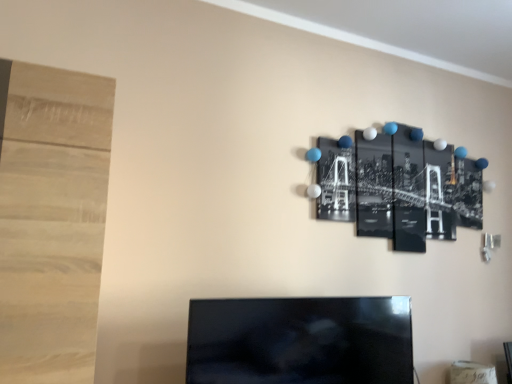
In order to face black glossy photo at upper right, should I rotate leftwards or rightwards?

To align with it, rotate right about 20.350°.

This screenshot has height=384, width=512. Describe the element at coordinates (413, 190) in the screenshot. I see `black glossy photo at upper right` at that location.

Locate an element on the screen. Image resolution: width=512 pixels, height=384 pixels. black glossy photo at upper right is located at coordinates (413, 190).

Locate an element on the screen. The width and height of the screenshot is (512, 384). black glossy tv at center is located at coordinates (300, 341).

What do you see at coordinates (300, 341) in the screenshot? The image size is (512, 384). I see `black glossy tv at center` at bounding box center [300, 341].

Measure the distance between point (217,340) and camera.

The depth of point (217,340) is 1.35 meters.

Locate an element on the screen. This screenshot has height=384, width=512. black glossy photo at upper right is located at coordinates (413, 190).

Which is more to the left, black glossy tv at center or black glossy photo at upper right?

black glossy tv at center is more to the left.

Considering the relative positions of black glossy tv at center and black glossy photo at upper right in the image provided, is black glossy tv at center in front of black glossy photo at upper right?

Yes, black glossy tv at center is closer to the camera.

Is point (187, 356) positioned in front of point (471, 171)?

Yes, point (187, 356) is in front of point (471, 171).

From the image's perspective, is black glossy tv at center located above or below black glossy photo at upper right?

black glossy tv at center is situated lower than black glossy photo at upper right in the image.

From a real-world perspective, which is physically above, black glossy tv at center or black glossy photo at upper right?

From a 3D spatial view, black glossy photo at upper right is above.

Considering the relative sizes of black glossy tv at center and black glossy photo at upper right in the image provided, is black glossy tv at center wider than black glossy photo at upper right?

Correct, the width of black glossy tv at center exceeds that of black glossy photo at upper right.

Can you confirm if black glossy tv at center is taller than black glossy photo at upper right?

In fact, black glossy tv at center may be shorter than black glossy photo at upper right.

Is black glossy tv at center smaller than black glossy photo at upper right?

Actually, black glossy tv at center might be larger than black glossy photo at upper right.

Is black glossy photo at upper right inside black glossy tv at center?

No, black glossy photo at upper right is not a part of black glossy tv at center.

Is the surface of black glossy tv at center in direct contact with black glossy photo at upper right?

No, black glossy tv at center is not making contact with black glossy photo at upper right.

Is black glossy tv at center facing towards black glossy photo at upper right?

No, black glossy tv at center is not oriented towards black glossy photo at upper right.

How many degrees apart are the facing directions of black glossy tv at center and black glossy photo at upper right?

black glossy tv at center and black glossy photo at upper right are facing 1.99 degrees away from each other.

The height and width of the screenshot is (384, 512). I want to click on bulletin board above the black glossy tv at center (from the image's perspective), so click(x=413, y=190).

Considering the positions of objects black glossy photo at upper right and black glossy tv at center in the image provided, who is more to the left, black glossy photo at upper right or black glossy tv at center?

From the viewer's perspective, black glossy tv at center appears more on the left side.

Which is in front, black glossy photo at upper right or black glossy tv at center?

black glossy tv at center is in front.

Which point is more distant from viewer, (454, 236) or (274, 318)?

The point (454, 236) is farther from the camera.

From the image's perspective, does black glossy photo at upper right appear lower than black glossy tv at center?

No, from the image's perspective, black glossy photo at upper right is not beneath black glossy tv at center.

From a real-world perspective, which is physically above, black glossy photo at upper right or black glossy tv at center?

black glossy photo at upper right is physically above.

Considering the relative sizes of black glossy photo at upper right and black glossy tv at center in the image provided, is black glossy photo at upper right wider than black glossy tv at center?

Incorrect, the width of black glossy photo at upper right does not surpass that of black glossy tv at center.

Which of these two, black glossy photo at upper right or black glossy tv at center, stands shorter?

black glossy tv at center is shorter.

Which of these two, black glossy photo at upper right or black glossy tv at center, is smaller?

Smaller between the two is black glossy photo at upper right.

Is black glossy tv at center inside black glossy photo at upper right?

No.

Looking at this image, are black glossy photo at upper right and black glossy tv at center located far from each other?

No, black glossy photo at upper right is not far from black glossy tv at center.

Is black glossy photo at upper right aimed at black glossy tv at center?

No, black glossy photo at upper right does not turn towards black glossy tv at center.

Can you tell me how much black glossy photo at upper right and black glossy tv at center differ in facing direction?

They differ by 1.99 degrees in their facing directions.

Locate an element on the screen. bulletin board on the right side of black glossy tv at center is located at coordinates (413, 190).

Identify the location of bulletin board above the black glossy tv at center (from a real-world perspective). (413, 190).

Where is `bulletin board that is behind the black glossy tv at center`? Image resolution: width=512 pixels, height=384 pixels. bulletin board that is behind the black glossy tv at center is located at coordinates (413, 190).